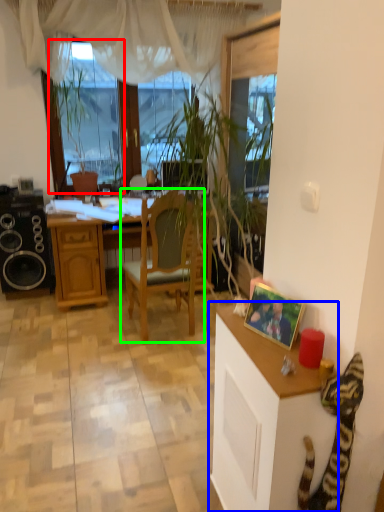
Question: Considering the real-world distances, which object is closest to window screen (highlighted by a red box)? cabinetry (highlighted by a blue box) or chair (highlighted by a green box).

Choices:
 (A) cabinetry
 (B) chair

Answer: (B)